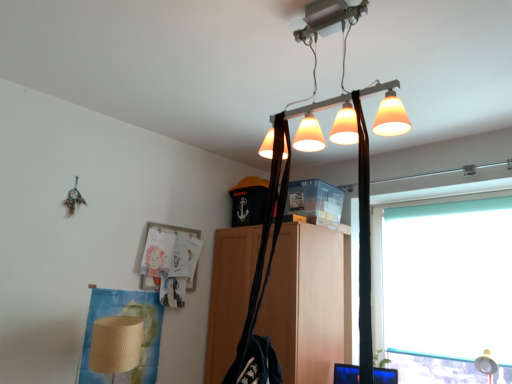
Question: Do you think teal matte window at right is within matte orange lampshade at upper center, or outside of it?

Choices:
 (A) inside
 (B) outside

Answer: (B)

Question: From a real-world perspective, relative to matte orange lampshade at upper center, is teal matte window at right vertically above or below?

Choices:
 (A) below
 (B) above

Answer: (A)

Question: Based on their relative distances, which object is nearer to the teal matte window at right?

Choices:
 (A) matte orange lampshade at upper center
 (B) black fabric shoulder bag at center
 (C) metallic gold table lamp at lower right
 (D) matte wood cabinet at center

Answer: (D)

Question: Which object is the closest to the matte wood cabinet at center?

Choices:
 (A) black fabric shoulder bag at center
 (B) matte orange lampshade at upper center
 (C) metallic gold table lamp at lower right
 (D) teal matte window at right

Answer: (D)